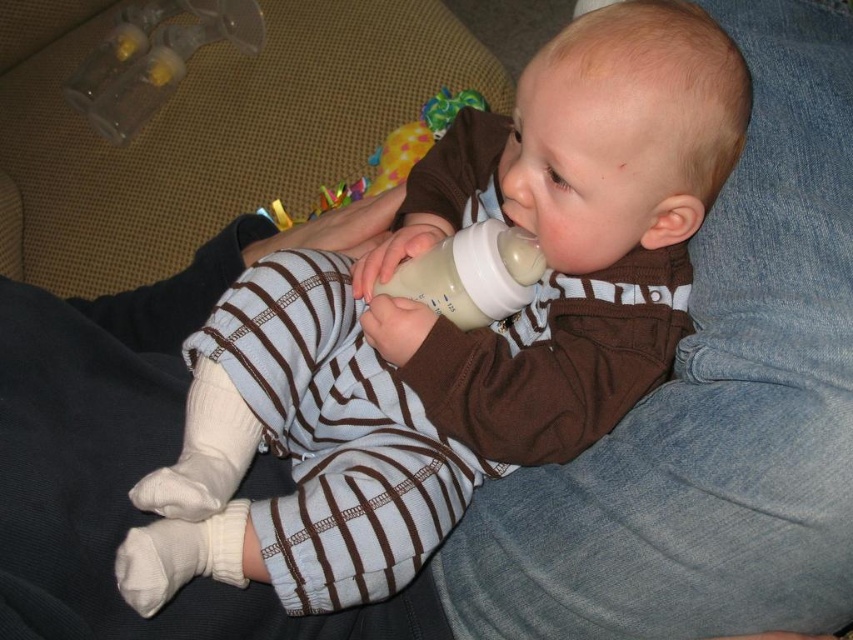
Consider the image. Does plastic colorful rattle at center have a greater width compared to transparent plastic bottle at upper left?

Yes, plastic colorful rattle at center is wider than transparent plastic bottle at upper left.

Who is positioned more to the left, plastic colorful rattle at center or transparent plastic bottle at upper left?

From the viewer's perspective, transparent plastic bottle at upper left appears more on the left side.

This screenshot has width=853, height=640. What do you see at coordinates (387, 156) in the screenshot? I see `plastic colorful rattle at center` at bounding box center [387, 156].

Locate an element on the screen. This screenshot has width=853, height=640. plastic colorful rattle at center is located at coordinates (387, 156).

Is point (146, 496) closer to camera compared to point (465, 260)?

Yes, it is.

Is point (651, 88) farther from viewer compared to point (494, 269)?

That is False.

Is point (625, 131) closer to camera compared to point (515, 250)?

Yes, point (625, 131) is in front of point (515, 250).

This screenshot has width=853, height=640. I want to click on blue striped onesie at center, so click(x=451, y=326).

Is blue striped onesie at center below transparent plastic bottle at upper left?

Indeed, blue striped onesie at center is positioned under transparent plastic bottle at upper left.

What are the coordinates of `blue striped onesie at center` in the screenshot? It's located at (451, 326).